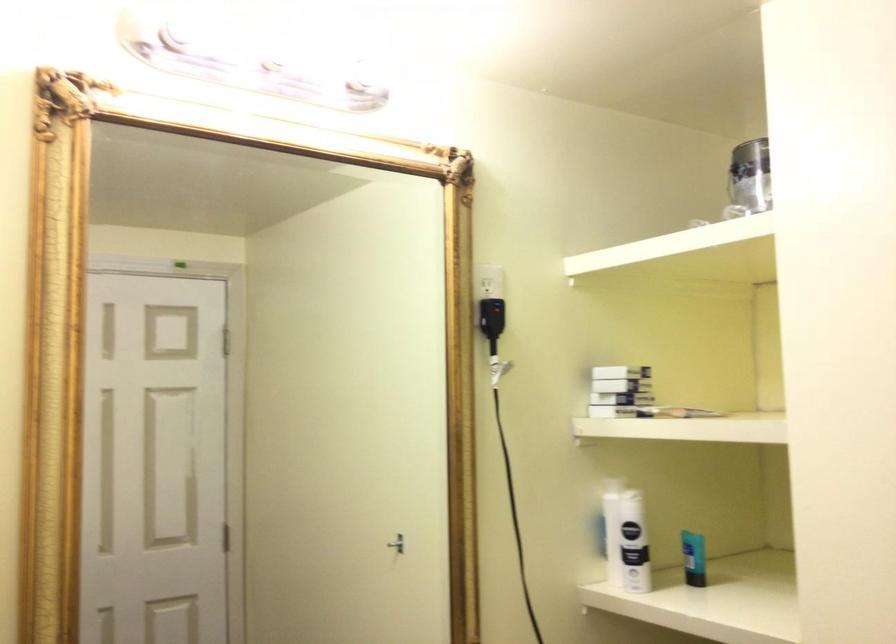
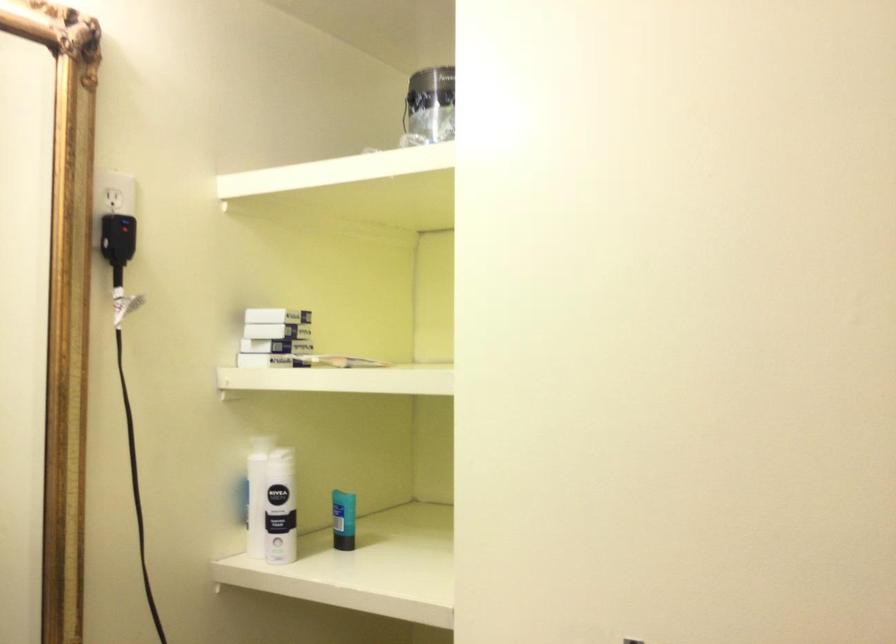
Locate, in the second image, the point that corresponds to the point at 631,373 in the first image.

(277, 315)